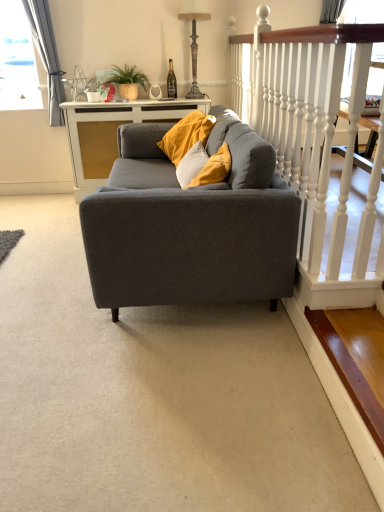
Question: Would you say wooden stair at lower right is to the left or to the right of white glossy cabinet at center in the picture?

Choices:
 (A) left
 (B) right

Answer: (B)

Question: Is point pos(357,402) positioned closer to the camera than point pos(162,101)?

Choices:
 (A) farther
 (B) closer

Answer: (B)

Question: Estimate the real-world distances between objects in this image. Which object is closer to the wooden stair at lower right?

Choices:
 (A) white wooden railing at upper right
 (B) white glossy cabinet at center
 (C) matte gray couch at center
 (D) gray fabric curtain at upper left
 (E) antique bronze lamp at upper center

Answer: (C)

Question: Estimate the real-world distances between objects in this image. Which object is closer to the wooden stair at lower right?

Choices:
 (A) gray fabric curtain at upper left
 (B) white glossy cabinet at center
 (C) matte gray couch at center
 (D) antique bronze lamp at upper center
 (E) white wooden railing at upper right

Answer: (C)